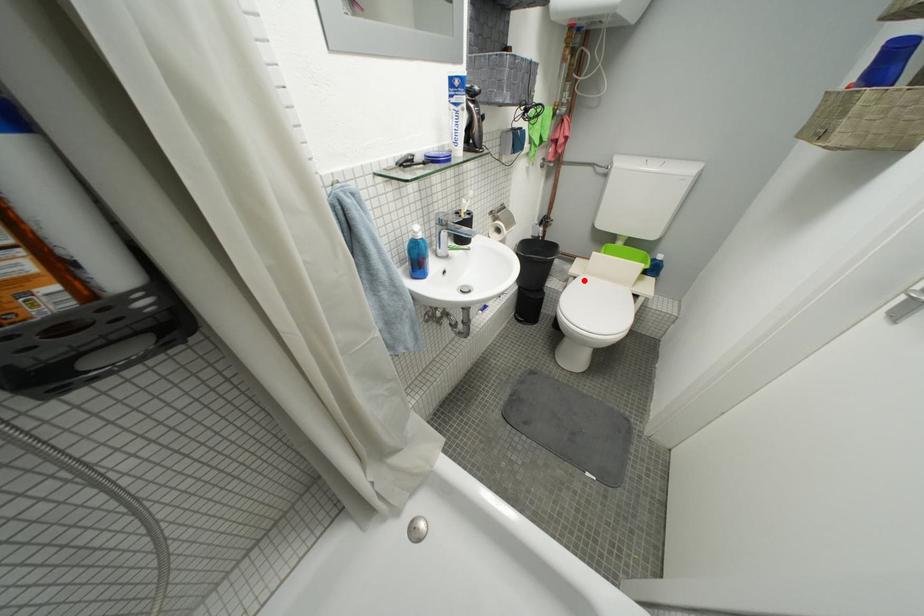
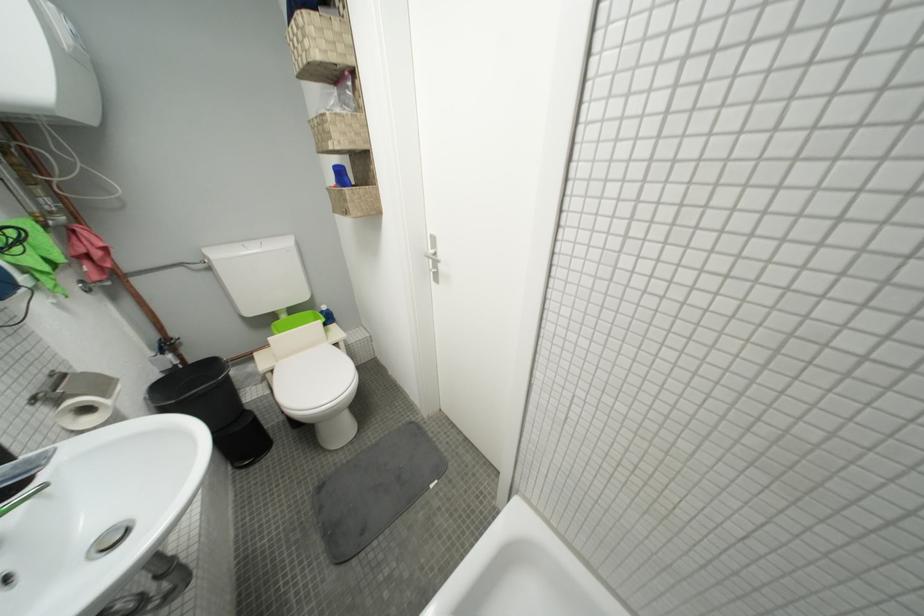
The point at the highlighted location is marked in the first image. Where is the corresponding point in the second image?

(281, 373)